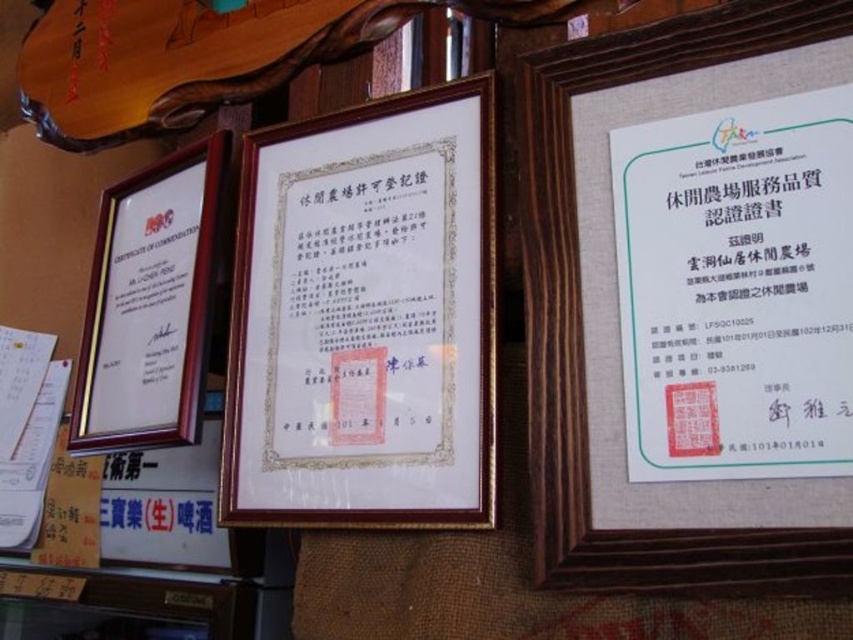
Question: Which object is the farthest from the wooden frame at center?

Choices:
 (A) white paper certificate at center
 (B) wooden picture frame at left
 (C) wooden frame at upper center

Answer: (A)

Question: Considering the relative positions of wooden frame at upper center and wooden picture frame at left in the image provided, where is wooden frame at upper center located with respect to wooden picture frame at left?

Choices:
 (A) right
 (B) left

Answer: (A)

Question: Does wooden frame at upper center come behind wooden picture frame at left?

Choices:
 (A) yes
 (B) no

Answer: (B)

Question: Estimate the real-world distances between objects in this image. Which object is closer to the wooden picture frame at left?

Choices:
 (A) wooden frame at upper center
 (B) white paper certificate at center
 (C) wooden frame at center

Answer: (C)

Question: Does white paper certificate at center come behind wooden picture frame at left?

Choices:
 (A) yes
 (B) no

Answer: (B)

Question: Which object is positioned farthest from the wooden picture frame at left?

Choices:
 (A) wooden frame at upper center
 (B) wooden frame at center

Answer: (A)